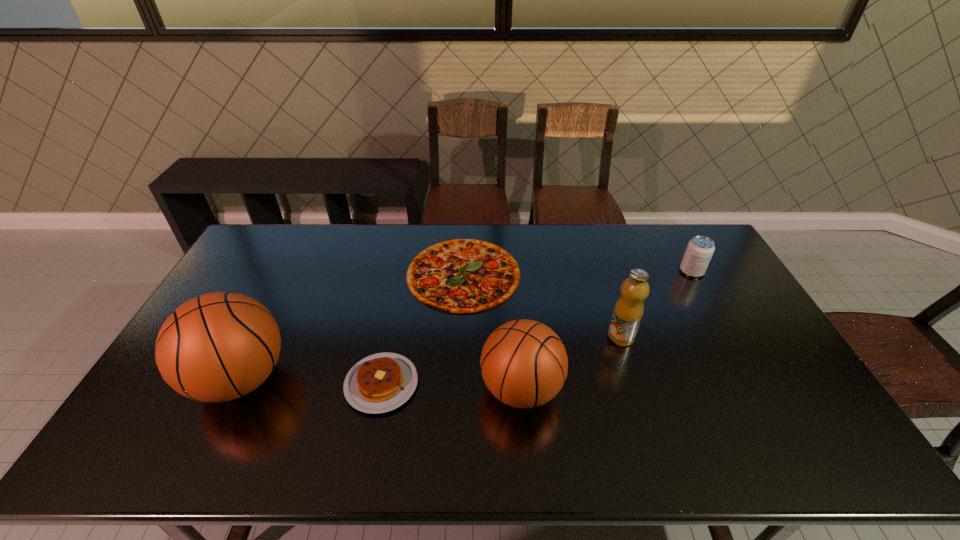
What are the coordinates of `vacant space located on the back of the soda can` in the screenshot? It's located at (x=671, y=234).

Identify the location of blank area located on the right of the pizza. The height and width of the screenshot is (540, 960). (543, 274).

The height and width of the screenshot is (540, 960). I want to click on vacant region located on the front label of the fifth object from left to right, so click(x=642, y=404).

At what (x,y) coordinates should I click in order to perform the action: click on free space located on the right of the pancake. Please return your answer as a coordinate pair (x, y). The width and height of the screenshot is (960, 540). Looking at the image, I should click on (470, 383).

The height and width of the screenshot is (540, 960). Identify the location of object that is at the far edge. (461, 276).

Where is `pancake that is positioned at the near edge`? pancake that is positioned at the near edge is located at coordinates (381, 382).

Find the location of a particular element. The width and height of the screenshot is (960, 540). object that is at the left edge is located at coordinates (217, 347).

Image resolution: width=960 pixels, height=540 pixels. What are the coordinates of `object present at the right edge` in the screenshot? It's located at (699, 251).

Image resolution: width=960 pixels, height=540 pixels. I want to click on object positioned at the near left corner, so click(x=217, y=347).

Find the location of a particular element. blank area at the far edge is located at coordinates (318, 227).